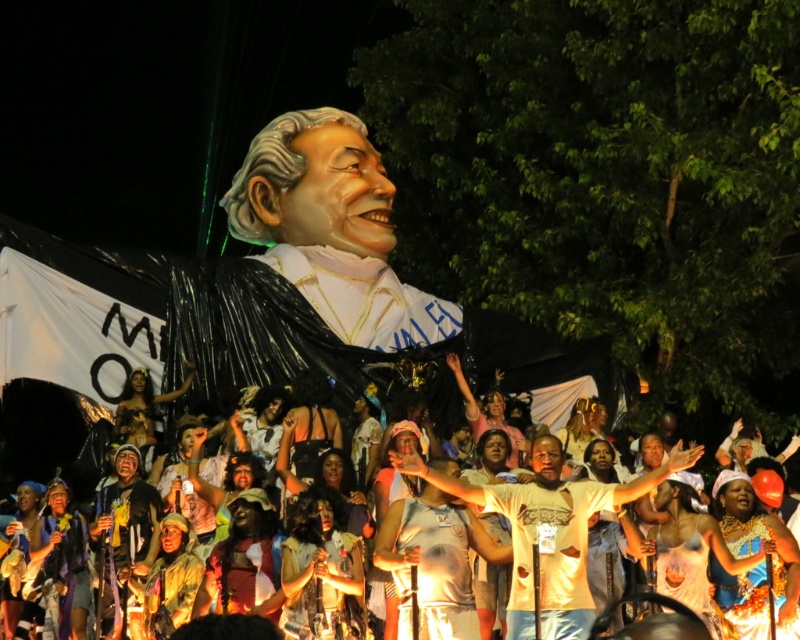
You are standing in the crowd watching the float. There are two points marked in the image. Which point, point [550,596] or point [554,454], is closer to you?

Point [550,596] is closer to the camera than point [554,454], so it is closer to you.